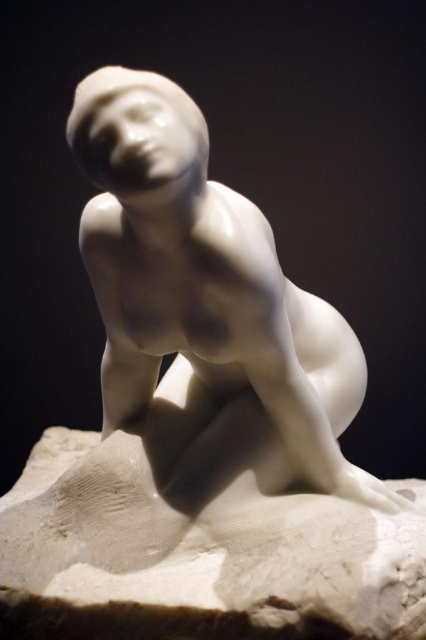
You are standing in front of the sculpture and want to touch the point at coordinates point (x=293, y=429) on the sculpture. If your hand can reach up to 1 meter, can you reach it?

The point (x=293, y=429) and the viewer are 1.04 meters apart, so your hand cannot reach it since it is slightly beyond the 1 meter limit.

You are an art conservator assessing the stability of the white glossy statue at center and the white marble base at lower center. Considering their heights, which object is more likely to tip over if a slight force is applied?

The white marble base at lower center is shorter and thus has a lower center of gravity, making it more stable. The white glossy statue at center is much taller and therefore more prone to tipping over due to its higher center of gravity.

You are an art student analyzing the sculpture. You notice two points on the sculpture. The first point is at coordinates point (354,376) and the second is at point (253,604). From your viewing position, which point is closer to you?

Point (253,604) is closer to you because it is in front of point (354,376) according to the spatial relationship provided.